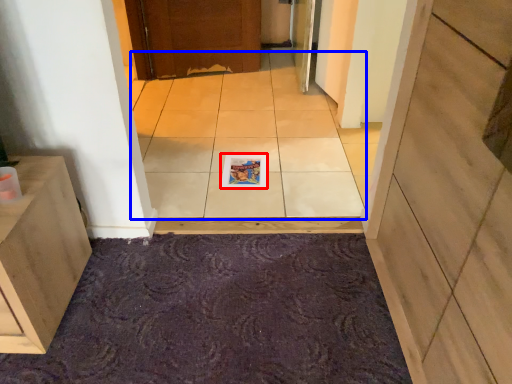
Question: Which point is closer to the camera, magazine (highlighted by a red box) or ceramic tile (highlighted by a blue box)?

Choices:
 (A) magazine
 (B) ceramic tile

Answer: (B)